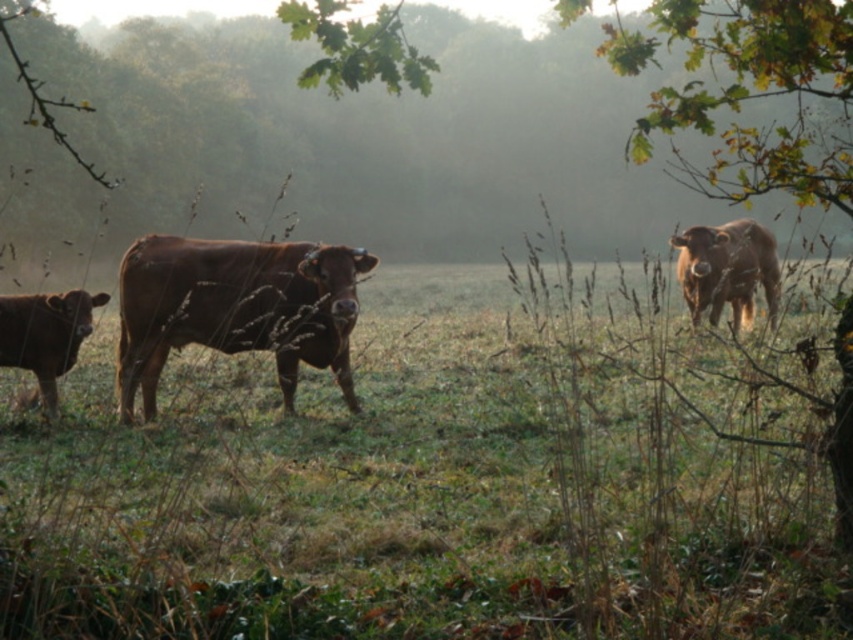
Question: Estimate the real-world distances between objects in this image. Which object is farther from the green leafy tree at upper center?

Choices:
 (A) brown matte cow at right
 (B) shiny brown bull at lower left
 (C) brown grassy at center

Answer: (B)

Question: Which object appears closest to the camera in this image?

Choices:
 (A) brown matte cow at center
 (B) green leafy tree at upper center
 (C) brown matte cow at right

Answer: (A)

Question: Which point appears farthest from the camera in this image?

Choices:
 (A) (350, 284)
 (B) (753, 600)

Answer: (A)

Question: Is the position of green leafy tree at upper center more distant than that of brown matte cow at right?

Choices:
 (A) yes
 (B) no

Answer: (A)

Question: Does brown grassy at center come behind shiny brown bull at lower left?

Choices:
 (A) no
 (B) yes

Answer: (A)

Question: Considering the relative positions of brown matte cow at center and brown matte cow at right in the image provided, where is brown matte cow at center located with respect to brown matte cow at right?

Choices:
 (A) below
 (B) above

Answer: (A)